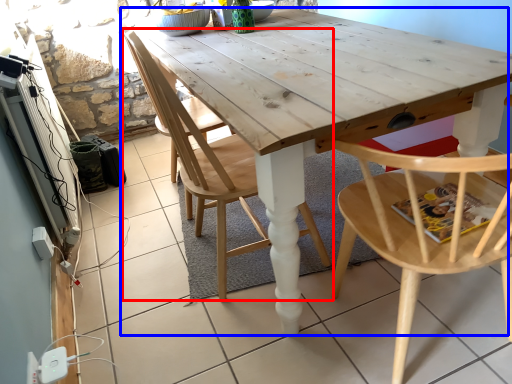
Question: Which object is further to the camera taking this photo, chair (highlighted by a red box) or table (highlighted by a blue box)?

Choices:
 (A) chair
 (B) table

Answer: (A)